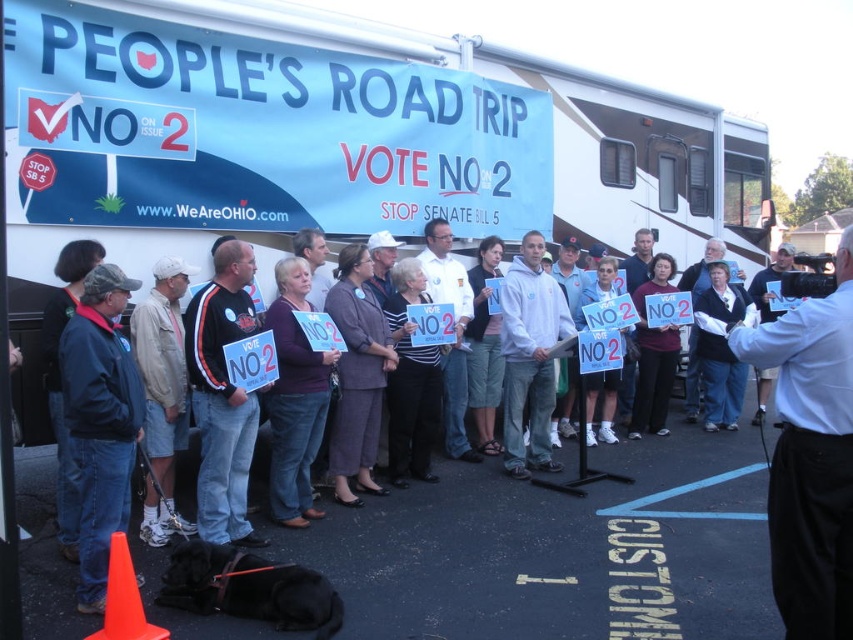
Between white shirt at center and denim jacket at left, which one is positioned higher?

denim jacket at left

Measure the distance between white shirt at center and camera.

white shirt at center and camera are 9.62 feet apart from each other.

This screenshot has width=853, height=640. Find the location of `white shirt at center`. white shirt at center is located at coordinates (810, 456).

Image resolution: width=853 pixels, height=640 pixels. What are the coordinates of `white shirt at center` in the screenshot? It's located at (810, 456).